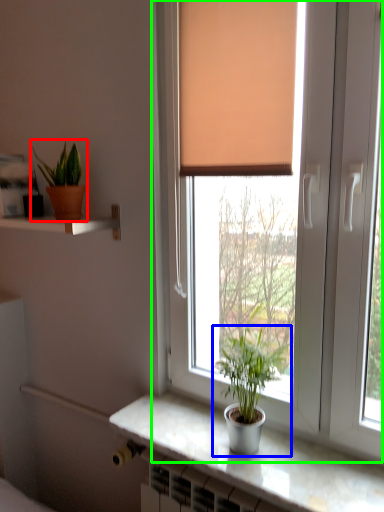
Question: Which object is the farthest from houseplant (highlighted by a red box)? Choose among these: houseplant (highlighted by a blue box) or window (highlighted by a green box).

Choices:
 (A) houseplant
 (B) window

Answer: (A)